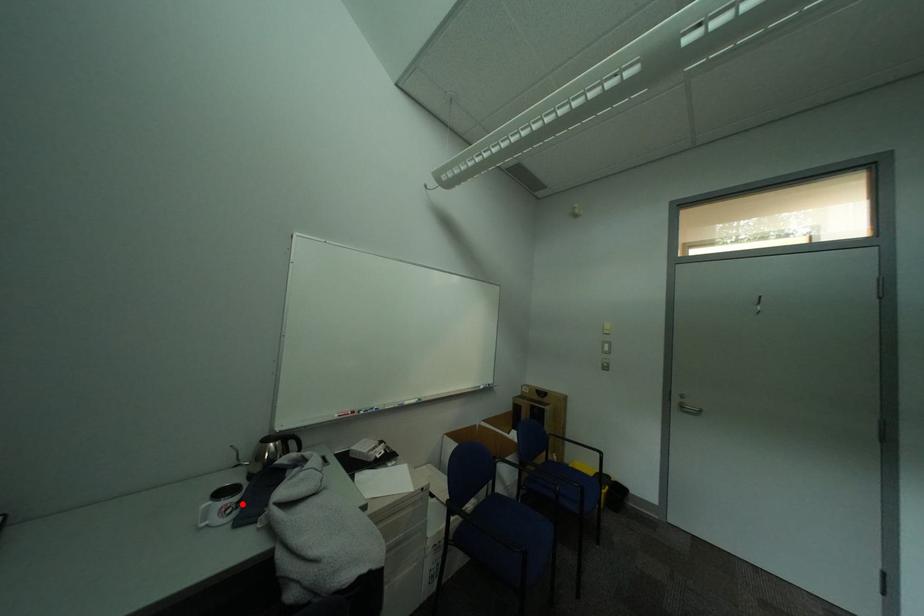
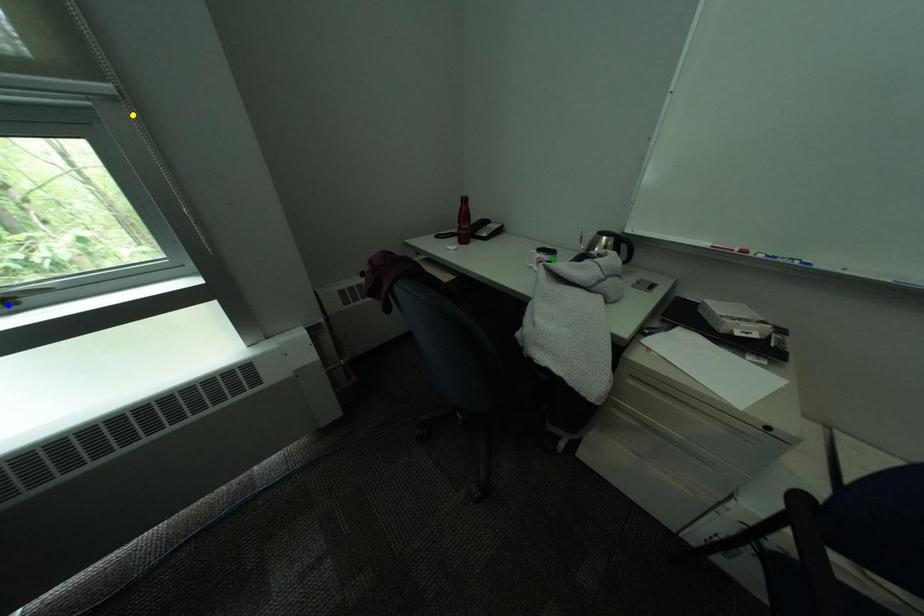
Question: I am providing you with two images of the same scene from different viewpoints. A red point is marked on the first image. You are given multiple points on the second image. Which spot in image 2 lines up with the point in image 1?

Choices:
 (A) yellow point
 (B) blue point
 (C) green point

Answer: (C)